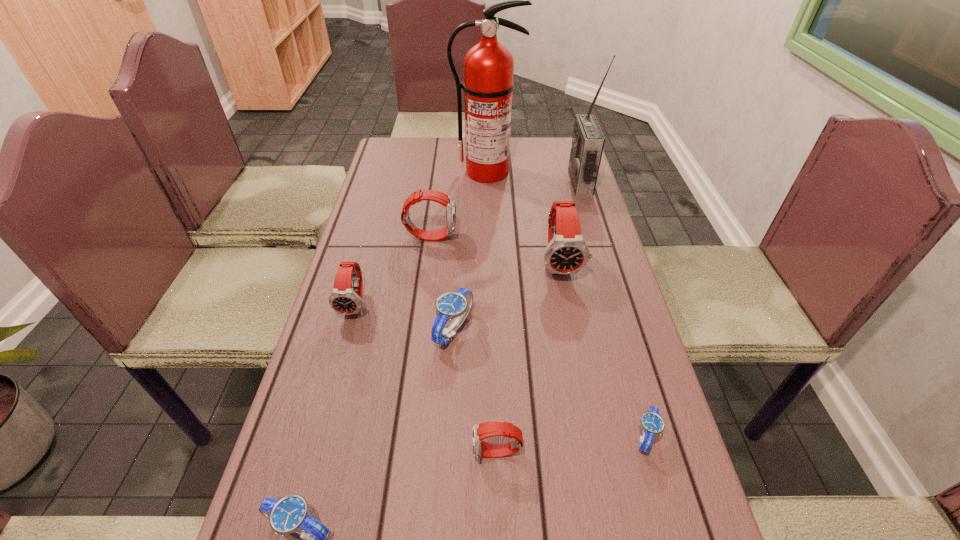
Find the location of a particular element. red fire extinguisher is located at coordinates (488, 85).

Find the location of a particular element. This screenshot has width=960, height=540. fire extinguisher is located at coordinates (488, 85).

Find the location of a particular element. This screenshot has height=540, width=960. the eighth shortest object is located at coordinates (588, 140).

You are a GUI agent. You are given a task and a screenshot of the screen. Output one action in this format:
    pyautogui.click(x=<x>, y=<y>)
    Task: Click on the tallest watch
    The height and width of the screenshot is (540, 960).
    Given the screenshot: What is the action you would take?
    pyautogui.click(x=567, y=252)

Locate an element on the screen. The width and height of the screenshot is (960, 540). the rightmost red watch is located at coordinates tap(567, 252).

At what (x,y) coordinates should I click in order to perform the action: click on the sixth shortest object. Please return your answer as a coordinate pair (x, y). Looking at the image, I should click on (447, 201).

This screenshot has height=540, width=960. Find the location of `the second tallest watch`. the second tallest watch is located at coordinates (447, 201).

Locate an element on the screen. This screenshot has height=540, width=960. the fifth tallest object is located at coordinates (344, 299).

This screenshot has width=960, height=540. Identify the location of the third tallest watch. (344, 299).

Image resolution: width=960 pixels, height=540 pixels. Find the location of `the farthest blue watch`. the farthest blue watch is located at coordinates (457, 304).